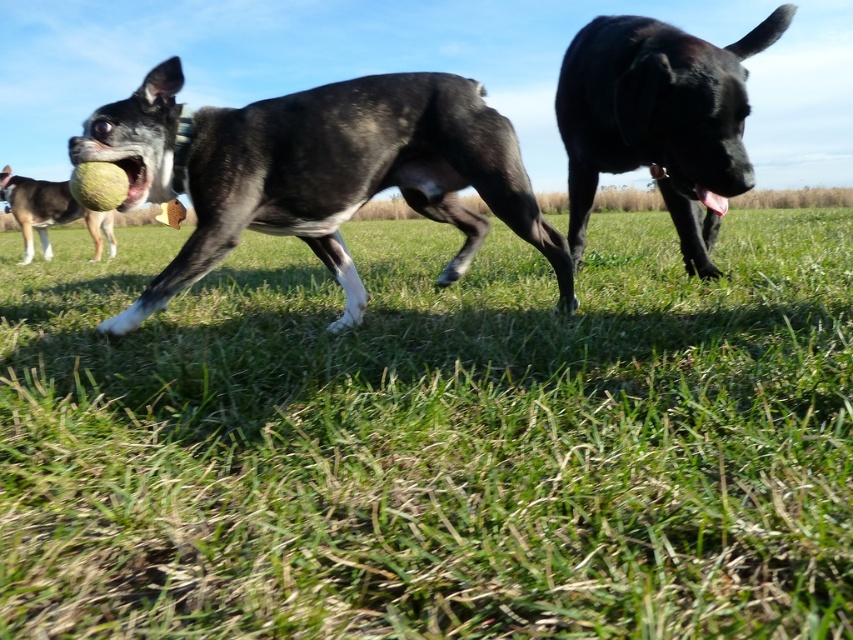
Question: Can you confirm if green grass at center is positioned to the left of black matte dog at center?

Choices:
 (A) yes
 (B) no

Answer: (A)

Question: Which point appears farthest from the camera in this image?

Choices:
 (A) (592, 200)
 (B) (45, 209)

Answer: (B)

Question: Which point is farther to the camera?

Choices:
 (A) (222, 147)
 (B) (128, 529)
 (C) (567, 67)

Answer: (C)

Question: From the image, what is the correct spatial relationship of black glossy dog at center in relation to shiny black tennis ball at center?

Choices:
 (A) above
 (B) below

Answer: (B)

Question: Which point is closer to the camera?

Choices:
 (A) (177, 154)
 (B) (532, 618)
 (C) (602, 147)

Answer: (B)

Question: Does green grass at center have a greater width compared to shiny black tennis ball at center?

Choices:
 (A) yes
 (B) no

Answer: (B)